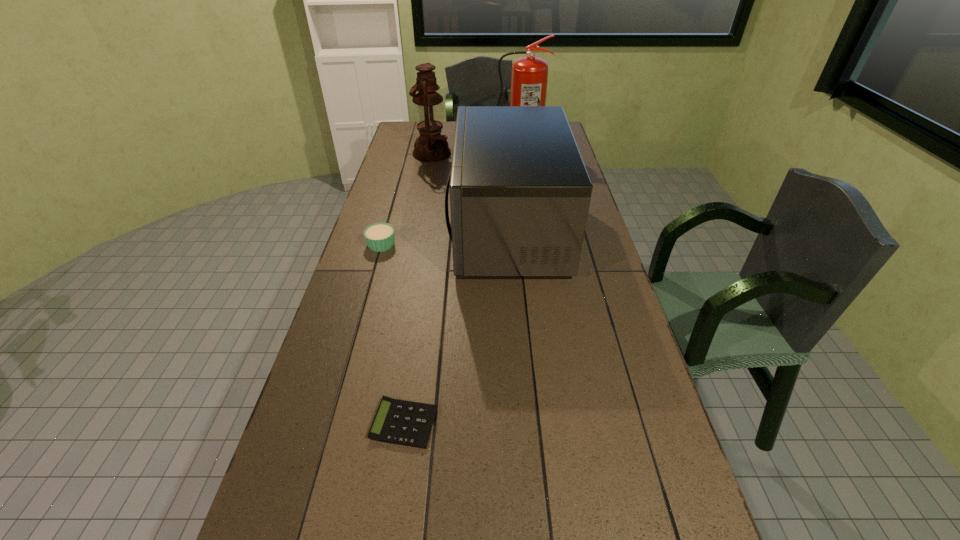
The width and height of the screenshot is (960, 540). I want to click on vacant point that satisfies the following two spatial constraints: 1. on the front side of the oil lamp; 2. on the left side of the calculator, so click(382, 423).

The height and width of the screenshot is (540, 960). I want to click on free space in the image that satisfies the following two spatial constraints: 1. on the front side of the calculator; 2. on the right side of the fourth tallest object, so point(330,423).

Find the location of `free spot that satisfies the following two spatial constraints: 1. on the front-facing side of the microwave oven; 2. on the front side of the nearest object`. free spot that satisfies the following two spatial constraints: 1. on the front-facing side of the microwave oven; 2. on the front side of the nearest object is located at coordinates (525, 423).

The height and width of the screenshot is (540, 960). I want to click on free space that satisfies the following two spatial constraints: 1. on the instruction side of the tallest object; 2. on the front-facing side of the microwave oven, so click(x=528, y=230).